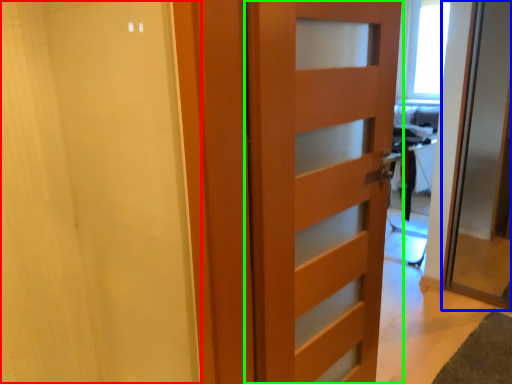
Question: Which object is positioned closest to shower curtain (highlighted by a red box)? Select from door (highlighted by a blue box) and door (highlighted by a green box).

Choices:
 (A) door
 (B) door

Answer: (B)